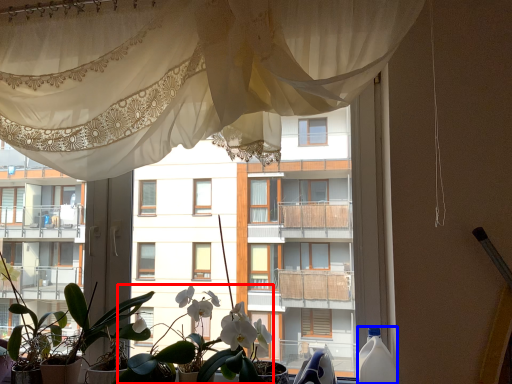
Question: Which object is closer to the camera taking this photo, floral arrangement (highlighted by a red box) or bottle (highlighted by a blue box)?

Choices:
 (A) floral arrangement
 (B) bottle

Answer: (B)